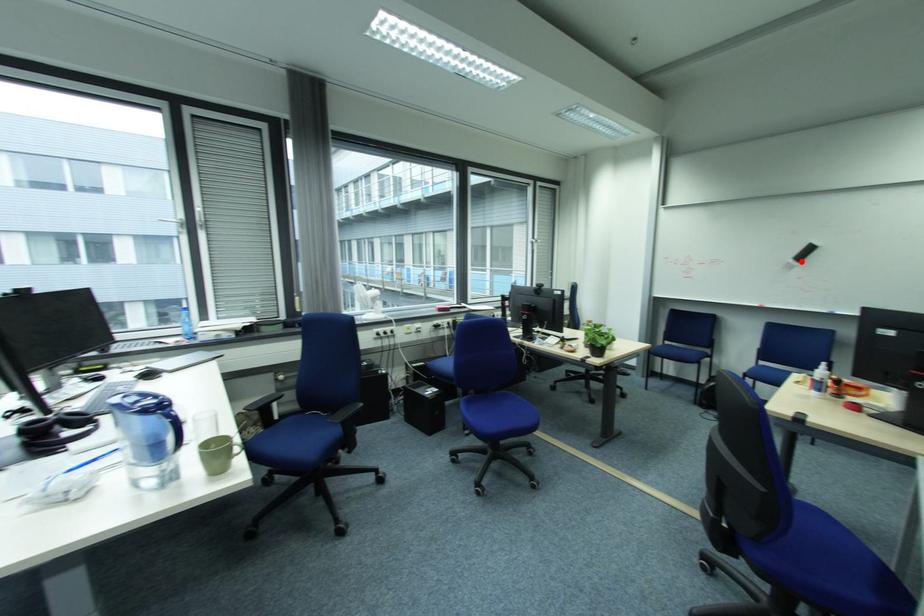
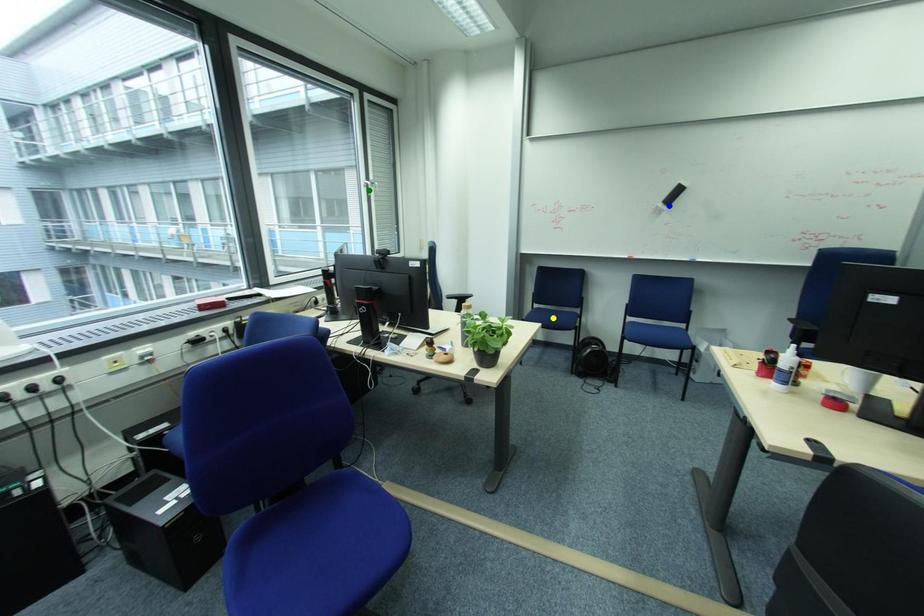
Question: I am providing you with two images of the same scene from different viewpoints. A red point is marked on the first image. You are given multiple points on the second image. Which mark in image 2 goes with the point in image 1?

Choices:
 (A) yellow point
 (B) green point
 (C) blue point

Answer: (C)